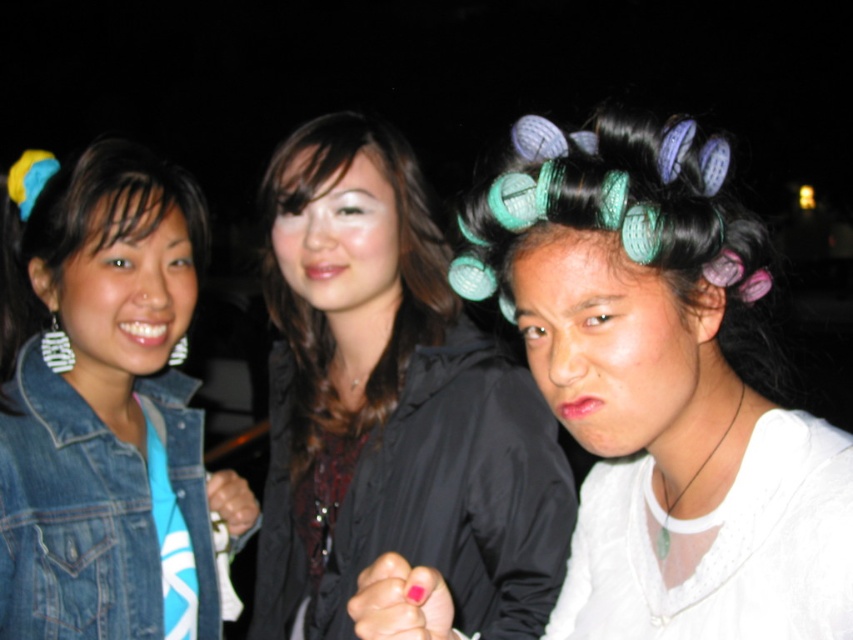
Where is `teal plastic hair rollers at center`? The height and width of the screenshot is (640, 853). teal plastic hair rollers at center is located at coordinates (660, 387).

Between teal plastic hair rollers at center and teal plastic curlers at center, which one has less height?

teal plastic curlers at center is shorter.

Between point (838, 620) and point (741, 282), which one is positioned in front?

Point (838, 620)

Find the location of a particular element. The image size is (853, 640). teal plastic hair rollers at center is located at coordinates coord(660,387).

Does teal plastic hair rollers at center appear on the right side of denim jacket at lower left?

Correct, you'll find teal plastic hair rollers at center to the right of denim jacket at lower left.

Can you confirm if teal plastic hair rollers at center is positioned above denim jacket at lower left?

Indeed, teal plastic hair rollers at center is positioned over denim jacket at lower left.

Does point (756, 540) come in front of point (122, 564)?

That is True.

Locate an element on the screen. teal plastic hair rollers at center is located at coordinates (660, 387).

Who is more forward, [47,406] or [724,349]?

Positioned in front is point [724,349].

Between denim jacket at lower left and teal plastic curlers at center, which one is positioned lower?

denim jacket at lower left is below.

Who is more distant from viewer, (83, 630) or (735, 342)?

Point (83, 630)

Find the location of `denim jacket at lower left`. denim jacket at lower left is located at coordinates (71, 518).